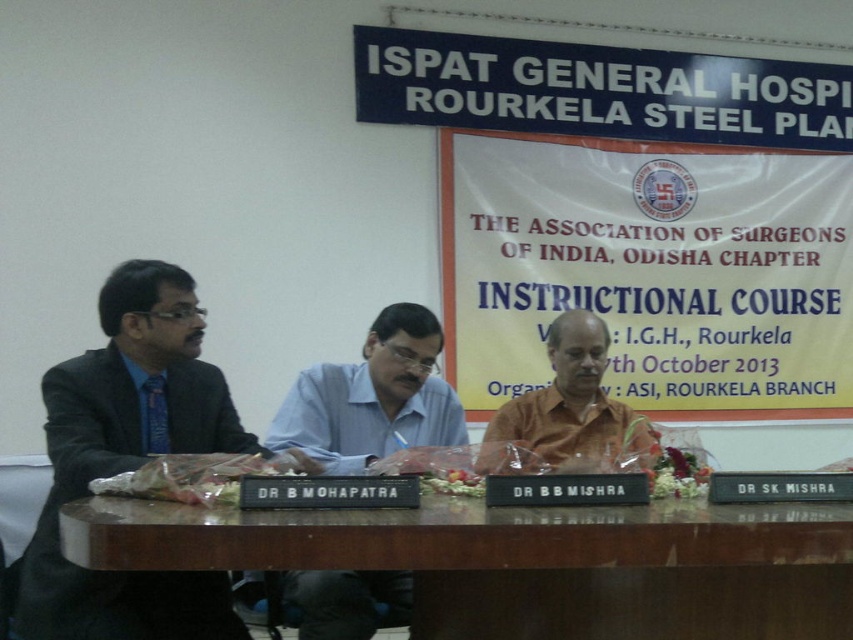
Question: Which point appears farthest from the camera in this image?

Choices:
 (A) (519, 394)
 (B) (529, 275)

Answer: (A)

Question: Based on their relative distances, which object is nearer to the matte black suit at left?

Choices:
 (A) orange matte shirt at center
 (B) yellow paper at center

Answer: (A)

Question: Is yellow paper at center closer to camera compared to matte black suit at left?

Choices:
 (A) yes
 (B) no

Answer: (B)

Question: Which point is farther to the camera?

Choices:
 (A) brown wooden table at center
 (B) matte black suit at left

Answer: (A)

Question: Can you confirm if matte black suit at left is positioned below orange matte shirt at center?

Choices:
 (A) no
 (B) yes

Answer: (B)

Question: Does brown wooden table at center have a lesser width compared to orange matte shirt at center?

Choices:
 (A) yes
 (B) no

Answer: (B)